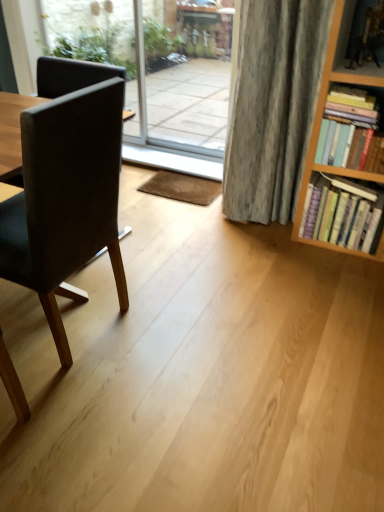
What do you see at coordinates (360, 40) in the screenshot? Image resolution: width=384 pixels, height=512 pixels. I see `wooden bookshelf at right` at bounding box center [360, 40].

Image resolution: width=384 pixels, height=512 pixels. What do you see at coordinates (194, 82) in the screenshot?
I see `transparent glass screen door at center` at bounding box center [194, 82].

This screenshot has height=512, width=384. What are the coordinates of `wooden bookshelf at right` in the screenshot? It's located at (360, 40).

From a real-world perspective, is hardcover books at right, the 1th book positioned from the top, beneath wooden bookshelf at right?

Yes, from a real-world perspective, hardcover books at right, the 1th book positioned from the top, is under wooden bookshelf at right.

How different are the orientations of hardcover books at right, the 1th book positioned from the top, and wooden bookshelf at right in degrees?

3.2 degrees separate the facing orientations of hardcover books at right, the 1th book positioned from the top, and wooden bookshelf at right.

Who is bigger, hardcover books at right, the 1th book positioned from the top, or wooden bookshelf at right?

hardcover books at right, the 1th book positioned from the top, is bigger.

Could you tell me if hardcover books at right, the second book in the bottom-to-top sequence, is facing wooden bookshelf at right?

No, hardcover books at right, the second book in the bottom-to-top sequence, does not turn towards wooden bookshelf at right.

How much distance is there between transparent glass screen door at center and hardcover books at right, arranged as the first book when ordered from the bottom?

transparent glass screen door at center is 8.30 feet away from hardcover books at right, arranged as the first book when ordered from the bottom.

Is transparent glass screen door at center next to hardcover books at right, arranged as the first book when ordered from the bottom?

They are not placed beside each other.

Between transparent glass screen door at center and hardcover books at right, arranged as the first book when ordered from the bottom, which one has smaller width?

With smaller width is transparent glass screen door at center.

Is point (177, 96) closer or farther from the camera than point (317, 208)?

Clearly, point (177, 96) is more distant from the camera than point (317, 208).

Could you tell me if hardcover books at right, the 1th book positioned from the top, is facing transparent glass screen door at center?

No.

How different are the orientations of hardcover books at right, the second book in the bottom-to-top sequence, and transparent glass screen door at center in degrees?

They differ by 1.71 degrees in their facing directions.

Is hardcover books at right, the second book in the bottom-to-top sequence, inside the boundaries of transparent glass screen door at center, or outside?

hardcover books at right, the second book in the bottom-to-top sequence, lies outside transparent glass screen door at center.

Is hardcover books at right, the 1th book positioned from the top, bigger than transparent glass screen door at center?

No.

Can you see wooden bookshelf at right touching matte black chair at left?

There is a gap between wooden bookshelf at right and matte black chair at left.

At what (x,y) coordinates should I click in order to perform the action: click on chair below the wooden bookshelf at right (from the image's perspective). Please return your answer as a coordinate pair (x, y). Image resolution: width=384 pixels, height=512 pixels. Looking at the image, I should click on (66, 199).

Based on their sizes in the image, would you say wooden bookshelf at right is bigger or smaller than matte black chair at left?

Clearly, wooden bookshelf at right is smaller in size than matte black chair at left.

Can you tell me how much wooden bookshelf at right and black leather chair at left differ in facing direction?

They differ by 1.49 degrees in their facing directions.

Is wooden bookshelf at right wider than black leather chair at left?

Yes.

Where is `shelf below the black leather chair at left (from the image's perspective)`? This screenshot has width=384, height=512. shelf below the black leather chair at left (from the image's perspective) is located at coordinates (360, 40).

From the image's perspective, which is below, wooden bookshelf at right or black leather chair at left?

wooden bookshelf at right.

From the image's perspective, is matte black chair at left located beneath transparent glass screen door at center?

Yes.

How many degrees apart are the facing directions of matte black chair at left and transparent glass screen door at center?

The angle between the facing direction of matte black chair at left and the facing direction of transparent glass screen door at center is 88.7 degrees.

Consider the image. Which object is more forward, matte black chair at left or transparent glass screen door at center?

matte black chair at left.

Locate an element on the screen. Image resolution: width=384 pixels, height=512 pixels. screen door on the right of matte black chair at left is located at coordinates (194, 82).

Can you see hardcover books at right, arranged as the first book when ordered from the bottom, touching hardcover books at right, the second book in the bottom-to-top sequence?

No, hardcover books at right, arranged as the first book when ordered from the bottom, is not in contact with hardcover books at right, the second book in the bottom-to-top sequence.

From the picture: Considering the relative positions of hardcover books at right, arranged as the second book when viewed from the top, and hardcover books at right, the 1th book positioned from the top, in the image provided, is hardcover books at right, arranged as the second book when viewed from the top, to the left or to the right of hardcover books at right, the 1th book positioned from the top,?

hardcover books at right, arranged as the second book when viewed from the top, is positioned on hardcover books at right, the 1th book positioned from the top,'s right side.

Is the depth of hardcover books at right, arranged as the second book when viewed from the top, greater than that of hardcover books at right, the 1th book positioned from the top?

Yes, hardcover books at right, arranged as the second book when viewed from the top, is behind hardcover books at right, the 1th book positioned from the top.

Who is bigger, hardcover books at right, arranged as the first book when ordered from the bottom, or hardcover books at right, the second book in the bottom-to-top sequence?

hardcover books at right, arranged as the first book when ordered from the bottom, is bigger.

Image resolution: width=384 pixels, height=512 pixels. Identify the location of book that is the 1st object located below the wooden bookshelf at right (from the image's perspective). (345, 126).

At what (x,y) coordinates should I click in order to perform the action: click on screen door that appears above the hardcover books at right, arranged as the second book when viewed from the top (from the image's perspective). Please return your answer as a coordinate pair (x, y). Looking at the image, I should click on (194, 82).

When comparing their distances from hardcover books at right, arranged as the first book when ordered from the bottom, does black leather chair at left or matte black chair at left seem closer?

Based on the image, matte black chair at left appears to be nearer to hardcover books at right, arranged as the first book when ordered from the bottom.

Looking at the image, which one is located further to hardcover books at right, arranged as the second book when viewed from the top, black leather chair at left or transparent glass screen door at center?

black leather chair at left lies further to hardcover books at right, arranged as the second book when viewed from the top, than the other object.

When comparing their distances from black leather chair at left, does hardcover books at right, arranged as the second book when viewed from the top, or matte black chair at left seem further?

The object further to black leather chair at left is matte black chair at left.

When comparing their distances from transparent glass screen door at center, does hardcover books at right, arranged as the second book when viewed from the top, or matte black chair at left seem further?

matte black chair at left.

Estimate the real-world distances between objects in this image. Which object is further from hardcover books at right, the second book in the bottom-to-top sequence, wooden bookshelf at right or transparent glass screen door at center?

transparent glass screen door at center is further to hardcover books at right, the second book in the bottom-to-top sequence.

Based on their spatial positions, is wooden bookshelf at right or hardcover books at right, the 1th book positioned from the top, closer to black leather chair at left?

hardcover books at right, the 1th book positioned from the top, is closer to black leather chair at left.

Based on their spatial positions, is wooden bookshelf at right or transparent glass screen door at center closer to black leather chair at left?

transparent glass screen door at center is positioned closer to the anchor black leather chair at left.

Looking at the image, which one is located closer to hardcover books at right, arranged as the second book when viewed from the top, wooden bookshelf at right or black leather chair at left?

Among the two, wooden bookshelf at right is located nearer to hardcover books at right, arranged as the second book when viewed from the top.

Find the location of a particular element. The width and height of the screenshot is (384, 512). screen door between matte black chair at left and black leather chair at left along the z-axis is located at coordinates (194, 82).

At what (x,y) coordinates should I click in order to perform the action: click on shelf between matte black chair at left and hardcover books at right, arranged as the second book when viewed from the top. Please return your answer as a coordinate pair (x, y). Image resolution: width=384 pixels, height=512 pixels. Looking at the image, I should click on (360, 40).

Identify the location of shelf between matte black chair at left and black leather chair at left from front to back. (360, 40).

Locate an element on the screen. screen door between black leather chair at left and hardcover books at right, the second book in the bottom-to-top sequence, from left to right is located at coordinates (194, 82).